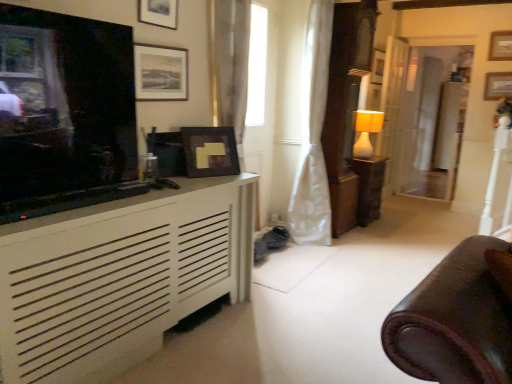
Question: Is white wood door at center right completely or partially inside white matte cabinet at left?

Choices:
 (A) no
 (B) yes

Answer: (A)

Question: Is white matte cabinet at left to the right of white wood door at center right from the viewer's perspective?

Choices:
 (A) yes
 (B) no

Answer: (B)

Question: Is white matte cabinet at left positioned with its back to white wood door at center right?

Choices:
 (A) no
 (B) yes

Answer: (A)

Question: Does white matte cabinet at left lie in front of white wood door at center right?

Choices:
 (A) no
 (B) yes

Answer: (B)

Question: Considering the relative sizes of white matte cabinet at left and white wood door at center right in the image provided, is white matte cabinet at left shorter than white wood door at center right?

Choices:
 (A) yes
 (B) no

Answer: (A)

Question: In terms of width, does matte white lamp at center-right look wider or thinner when compared to white matte cabinet at left?

Choices:
 (A) wide
 (B) thin

Answer: (B)

Question: In the image, is matte white lamp at center-right on the left side or the right side of white matte cabinet at left?

Choices:
 (A) left
 (B) right

Answer: (B)

Question: In the image, is matte white lamp at center-right positioned in front of or behind white matte cabinet at left?

Choices:
 (A) behind
 (B) front

Answer: (A)

Question: Based on their sizes in the image, would you say matte white lamp at center-right is bigger or smaller than white matte cabinet at left?

Choices:
 (A) big
 (B) small

Answer: (B)

Question: From the image's perspective, is wooden picture frame at upper right, the fourth picture frame from the front, above or below matte brown wooden table at center-right?

Choices:
 (A) below
 (B) above

Answer: (B)

Question: Looking at their shapes, would you say wooden picture frame at upper right, the fourth picture frame from the front, is wider or thinner than matte brown wooden table at center-right?

Choices:
 (A) wide
 (B) thin

Answer: (B)

Question: Relative to matte brown wooden table at center-right, is wooden picture frame at upper right, the sixth picture frame viewed from the left, in front or behind?

Choices:
 (A) front
 (B) behind

Answer: (B)

Question: From a real-world perspective, is wooden picture frame at upper right, which is counted as the first picture frame, starting from the right, above or below matte brown wooden table at center-right?

Choices:
 (A) above
 (B) below

Answer: (A)

Question: Is wooden picture frame at upper right, the fourth picture frame from the front, in front of or behind matte black picture frame at upper center, the 6th picture frame when ordered from right to left, in the image?

Choices:
 (A) behind
 (B) front

Answer: (A)

Question: Would you say wooden picture frame at upper right, which is the third picture frame in back-to-front order, is to the left or to the right of matte black picture frame at upper center, which is the first picture frame from left to right, in the picture?

Choices:
 (A) right
 (B) left

Answer: (A)